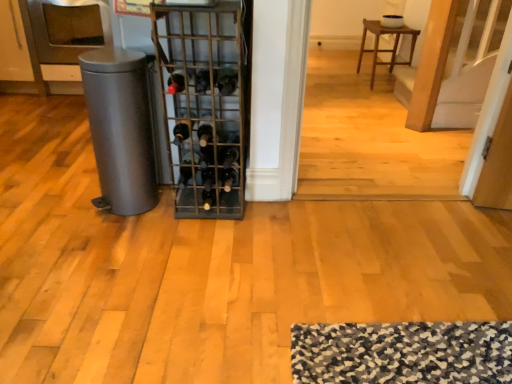
Where is `free space in front of metallic wire wine rack at center`? This screenshot has height=384, width=512. free space in front of metallic wire wine rack at center is located at coordinates (198, 246).